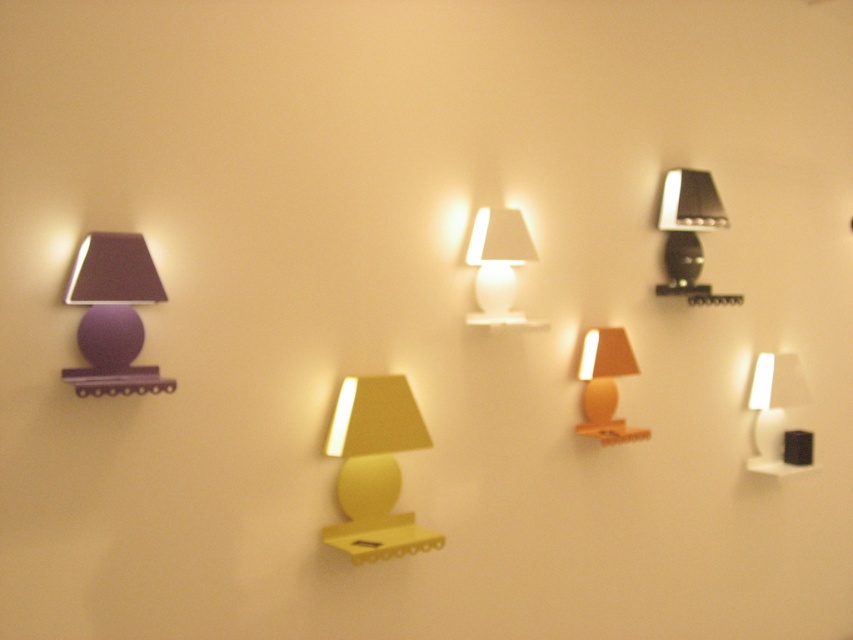
Question: Does yellow matte lamp at center lie behind white matte lamp at center?

Choices:
 (A) no
 (B) yes

Answer: (A)

Question: Which object appears closest to the camera in this image?

Choices:
 (A) white glossy lamp at right
 (B) matte purple lamp at left
 (C) yellow matte lamp at center

Answer: (B)

Question: Which object is positioned farthest from the white matte lamp at center?

Choices:
 (A) yellow matte lamp at center
 (B) metallic silver lamp at upper right
 (C) matte purple lamp at left
 (D) wooden beige lamp at center

Answer: (C)

Question: Is white glossy lamp at right further to the viewer compared to metallic silver lamp at upper right?

Choices:
 (A) yes
 (B) no

Answer: (A)

Question: Where is white glossy lamp at right located in relation to wooden beige lamp at center in the image?

Choices:
 (A) left
 (B) right

Answer: (B)

Question: Which point is closer to the camera?

Choices:
 (A) (387, 540)
 (B) (611, 388)

Answer: (A)